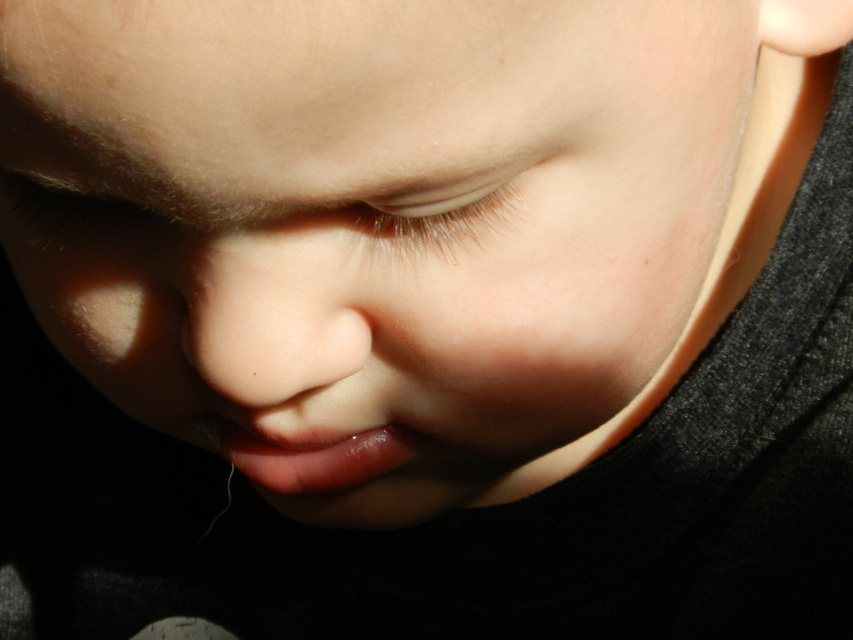
Question: Which point is farther to the camera?

Choices:
 (A) translucent skin at center
 (B) smooth flesh nose at center
 (C) smooth skin face at center
 (D) glossy pink lips at center

Answer: (D)

Question: Can you confirm if smooth flesh nose at center is positioned above translucent skin at center?

Choices:
 (A) no
 (B) yes

Answer: (A)

Question: Is translucent skin at center below glossy pink lips at center?

Choices:
 (A) no
 (B) yes

Answer: (A)

Question: Which point appears farthest from the camera in this image?

Choices:
 (A) (297, 448)
 (B) (410, 51)
 (C) (271, 317)
 (D) (416, 211)

Answer: (A)

Question: Which object appears closest to the camera in this image?

Choices:
 (A) smooth skin face at center
 (B) translucent skin at center

Answer: (A)

Question: Is smooth flesh nose at center positioned before glossy pink lips at center?

Choices:
 (A) yes
 (B) no

Answer: (A)